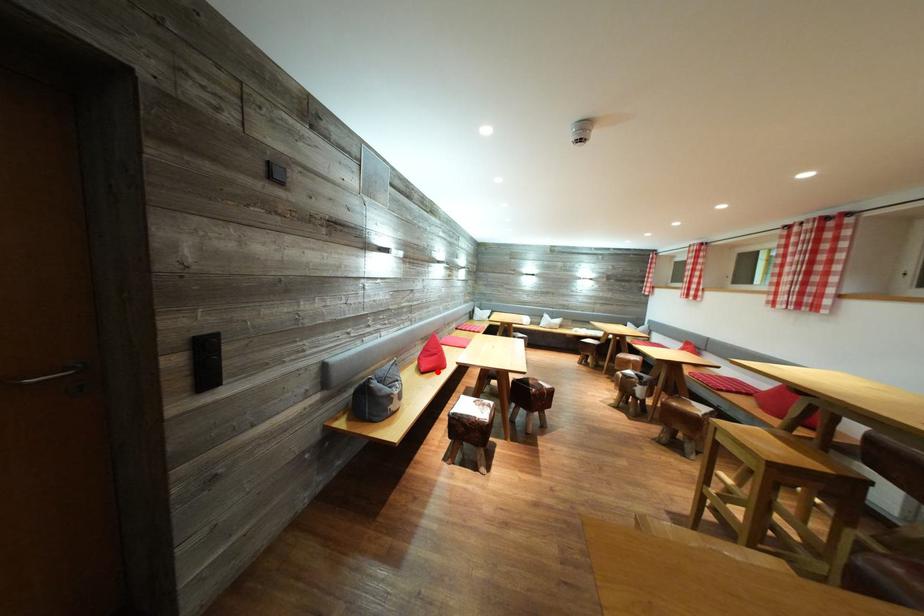
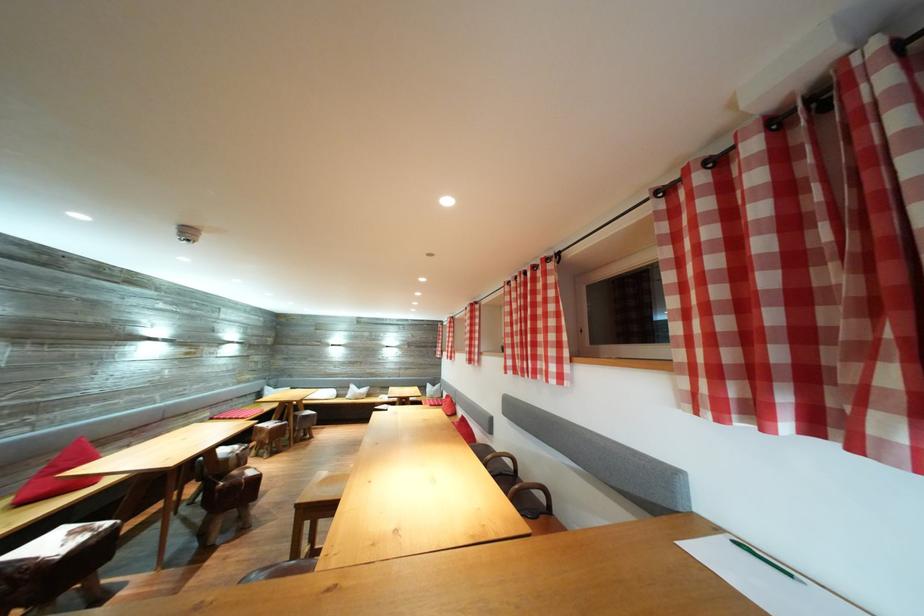
Where in the second image is the point corresponding to the highlighted location from the first image?

(51, 496)